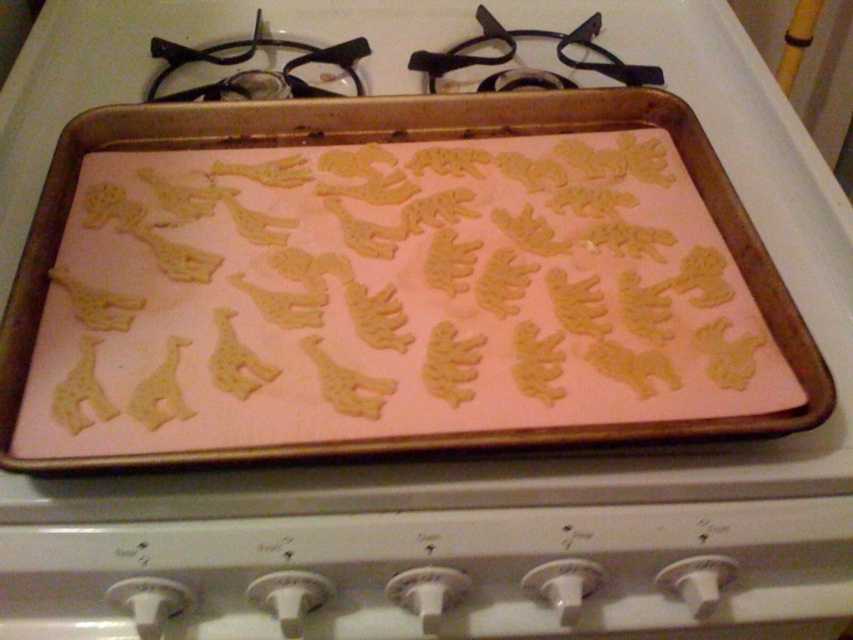
You are a chef trying to place a new cookie sheet on the stove. The golden brown cookie sheet at center is currently on the stove. Where exactly on the black metal gas stove at upper center should you place the new cookie sheet to avoid overlapping with the existing one?

The golden brown cookie sheet at center is to the right of the black metal gas stove at upper center, so placing the new cookie sheet to the left of the existing one would prevent overlapping.

You are a baker who needs to place a new cookie dough ball on the golden brown cookie sheet at center. The coordinates given are point (392, 284). Can you confirm if this point is located on the golden brown cookie sheet at center?

Yes, the point (392, 284) marks the golden brown cookie sheet at center, so placing the dough there would be correct.

From the picture: You are a baker who needs to place a new cookie sheet on the stove. Given that the golden brown cookie sheet at center is currently on the black metal gas stove at upper center, can you determine if the cookie sheet will fit on the stove?

The golden brown cookie sheet at center has a larger size compared to black metal gas stove at upper center, so it may not fit properly on the stove.